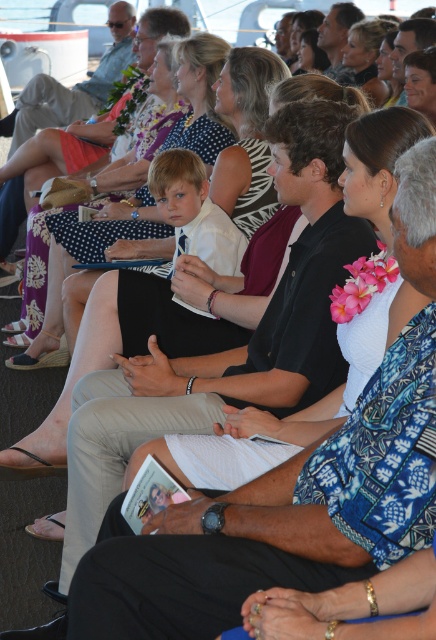
You are standing at the back of the stage and need to hand a document to the person wearing the black fabric dress at center and the matte black shirt at center. Which one is closer to you?

The black fabric dress at center is 8.56 meters away from the matte black shirt at center. Since the distance between them is 8.56 meters, both are equally distant from you unless you have more information about their exact positions relative to your location.

Looking at this image, you are a photographer trying to capture a clear photo of the black fabric dress at center and the matte black shirt at center. Which one will appear taller in the photo?

The matte black shirt at center appears taller than the black fabric dress at center in the photo because the black fabric dress at center is not as tall as matte black shirt at center.

You are a photographer standing at the back of the stage. You want to take a photo of both the black fabric dress at center and the white floral dress at center. The minimum distance between the two dresses for your camera to focus on both clearly is 10 feet. Can you capture both dresses in focus without moving closer?

The distance between the black fabric dress at center and the white floral dress at center is 13.26 feet, which is greater than the required 10 feet. Therefore, you can capture both dresses in focus without moving closer.